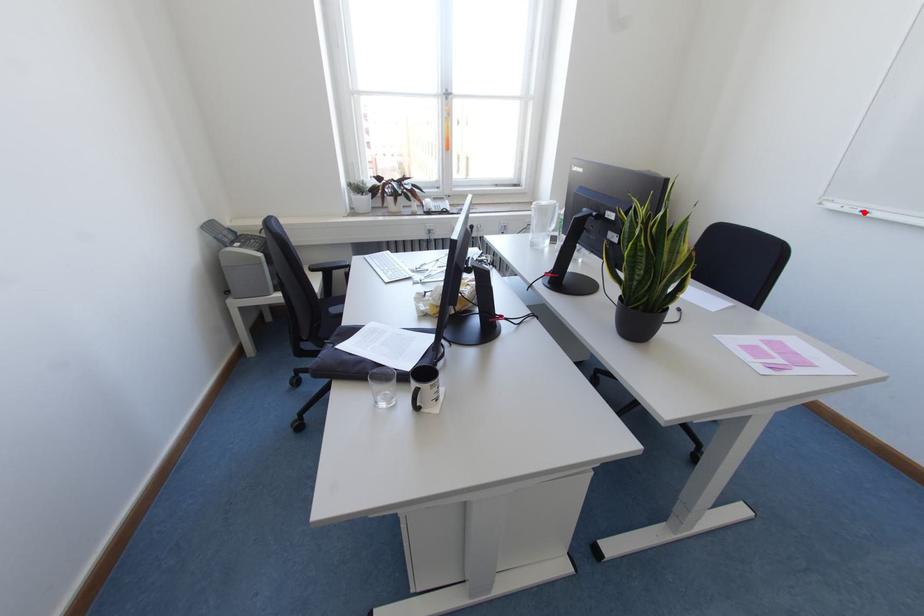
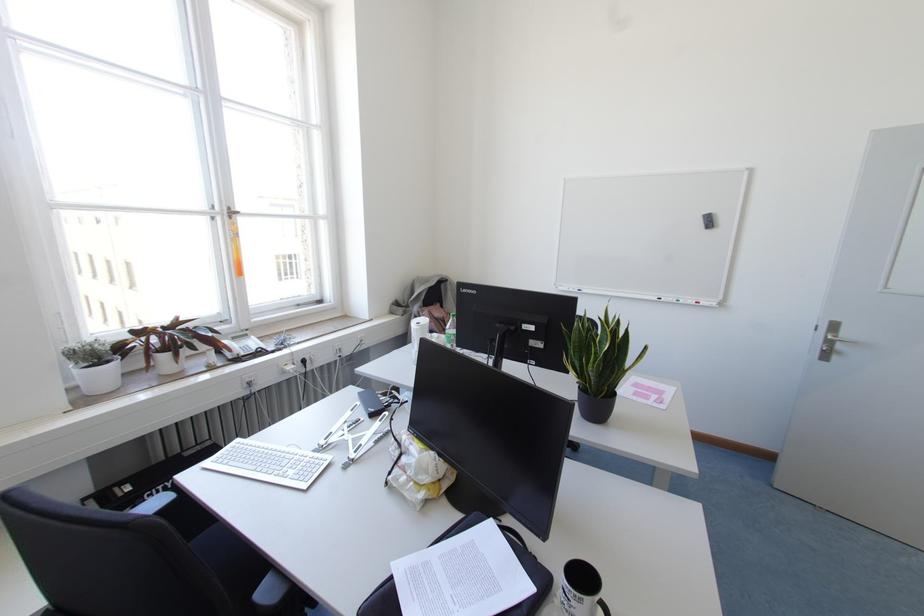
In the second image, find the point that corresponds to the highlighted location in the first image.

(578, 290)